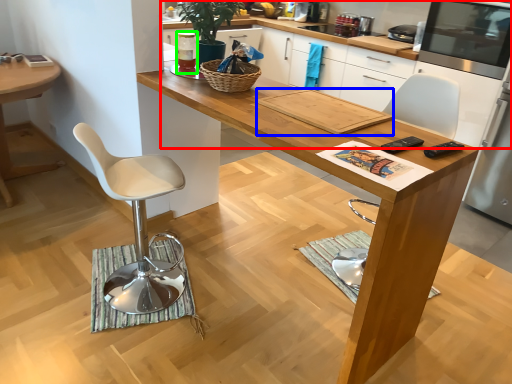
Question: Based on their relative distances, which object is nearer to cabinetry (highlighted by a red box)? Choose from magazine (highlighted by a blue box) and appliance (highlighted by a green box).

Choices:
 (A) magazine
 (B) appliance

Answer: (B)